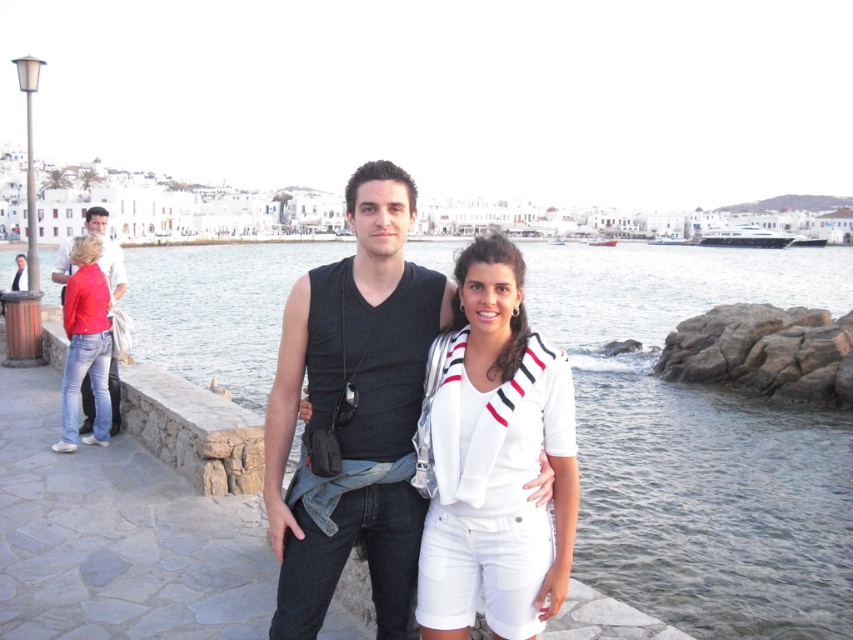
Which is more to the right, clear water at center or white cotton shirt at center?

Positioned to the right is white cotton shirt at center.

Is point (811, 296) positioned in front of point (432, 435)?

No, it is behind (432, 435).

Does point (590, 332) come farther from viewer compared to point (541, 394)?

Yes.

Locate an element on the screen. This screenshot has width=853, height=640. clear water at center is located at coordinates (700, 444).

Who is positioned more to the right, black sleeveless shirt at center or denim jeans at left?

From the viewer's perspective, black sleeveless shirt at center appears more on the right side.

Describe the element at coordinates (352, 413) in the screenshot. This screenshot has width=853, height=640. I see `black sleeveless shirt at center` at that location.

This screenshot has width=853, height=640. Describe the element at coordinates (352, 413) in the screenshot. I see `black sleeveless shirt at center` at that location.

The width and height of the screenshot is (853, 640). I want to click on black sleeveless shirt at center, so click(352, 413).

Does white cotton shirt at center appear over denim jeans at left?

Incorrect, white cotton shirt at center is not positioned above denim jeans at left.

Between point (541, 525) and point (90, 396), which one is positioned behind?

Point (90, 396)

Is point (434, 456) behind point (109, 276)?

No, (434, 456) is closer to viewer.

At what (x,y) coordinates should I click in order to perform the action: click on white cotton shirt at center. Please return your answer as a coordinate pair (x, y). The width and height of the screenshot is (853, 640). Looking at the image, I should click on (497, 461).